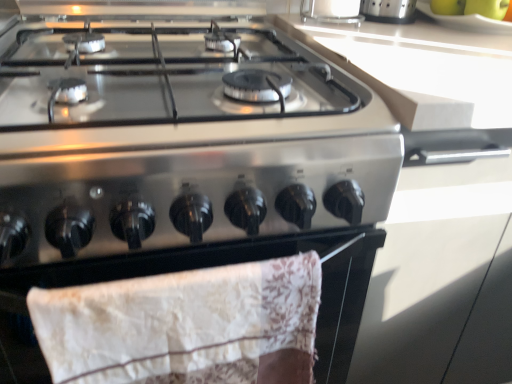
Question: Is green matte bananas at upper right, marked as the 2th fruit in a right-to-left arrangement, behind stainless steel gas stove at center?

Choices:
 (A) no
 (B) yes

Answer: (B)

Question: Is green matte bananas at upper right, marked as the 1th fruit in a left-to-right arrangement, smaller than stainless steel gas stove at center?

Choices:
 (A) yes
 (B) no

Answer: (A)

Question: Can you confirm if green matte bananas at upper right, marked as the 2th fruit in a right-to-left arrangement, is wider than stainless steel gas stove at center?

Choices:
 (A) no
 (B) yes

Answer: (A)

Question: Does green matte bananas at upper right, marked as the 1th fruit in a left-to-right arrangement, appear on the right side of stainless steel gas stove at center?

Choices:
 (A) no
 (B) yes

Answer: (B)

Question: Is green matte bananas at upper right, marked as the 1th fruit in a left-to-right arrangement, shorter than stainless steel gas stove at center?

Choices:
 (A) yes
 (B) no

Answer: (A)

Question: From a real-world perspective, is green matte bananas at upper right, marked as the 2th fruit in a right-to-left arrangement, above or below stainless steel gas stove at center?

Choices:
 (A) above
 (B) below

Answer: (A)

Question: In terms of width, does green matte bananas at upper right, marked as the 2th fruit in a right-to-left arrangement, look wider or thinner when compared to stainless steel gas stove at center?

Choices:
 (A) thin
 (B) wide

Answer: (A)

Question: From the image's perspective, is green matte bananas at upper right, marked as the 1th fruit in a left-to-right arrangement, positioned above or below stainless steel gas stove at center?

Choices:
 (A) below
 (B) above

Answer: (B)

Question: Is green matte bananas at upper right, marked as the 2th fruit in a right-to-left arrangement, situated inside stainless steel gas stove at center or outside?

Choices:
 (A) outside
 (B) inside

Answer: (A)

Question: Visually, is white lace towel at lower center positioned to the left or to the right of stainless steel gas stove at center?

Choices:
 (A) left
 (B) right

Answer: (B)

Question: Is white lace towel at lower center wider or thinner than stainless steel gas stove at center?

Choices:
 (A) thin
 (B) wide

Answer: (A)

Question: Is point (257, 259) closer or farther from the camera than point (41, 180)?

Choices:
 (A) closer
 (B) farther

Answer: (B)

Question: In the image, is white lace towel at lower center positioned in front of or behind stainless steel gas stove at center?

Choices:
 (A) front
 (B) behind

Answer: (B)

Question: Is green matte bananas at upper right, marked as the 2th fruit in a right-to-left arrangement, taller or shorter than clear glass container at upper center?

Choices:
 (A) short
 (B) tall

Answer: (A)

Question: Considering the positions of green matte bananas at upper right, marked as the 2th fruit in a right-to-left arrangement, and clear glass container at upper center in the image, is green matte bananas at upper right, marked as the 2th fruit in a right-to-left arrangement, wider or thinner than clear glass container at upper center?

Choices:
 (A) thin
 (B) wide

Answer: (A)